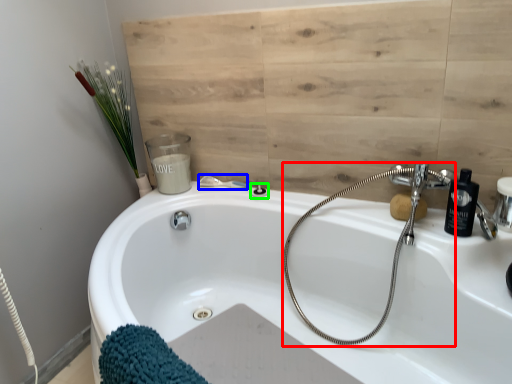
Question: Estimate the real-world distances between objects in this image. Which object is closer to plumbing fixture (highlighted by a red box), shower (highlighted by a blue box) or shower (highlighted by a green box)?

Choices:
 (A) shower
 (B) shower

Answer: (B)